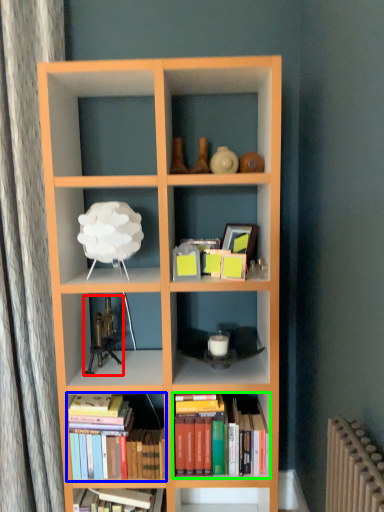
Question: Which object is positioned farthest from toy (highlighted by a red box)? Select from book (highlighted by a blue box) and book (highlighted by a green box).

Choices:
 (A) book
 (B) book

Answer: (B)